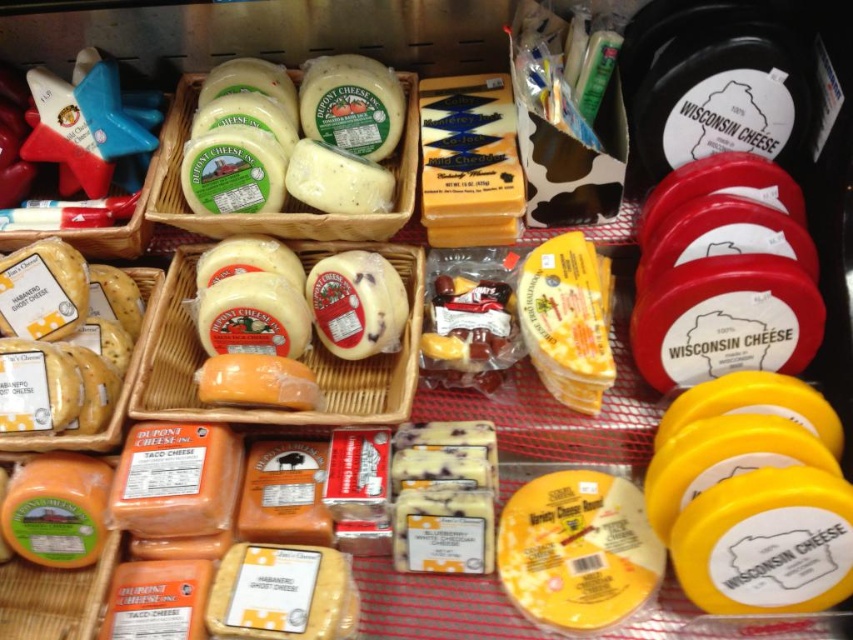
You are a customer standing in front of the cheese display. You want to pick up the yellow matte variety cheese round at center and the white paperboard cheese at center. Which one do you need to reach further back to grab?

The white paperboard cheese at center is further away from you, so you need to reach further back to grab it.

Based on the photo, you are a store employee who needs to restock the refrigerated section. You have two yellow cheeses to place on the shelf. The yellow matte variety cheese round at center and the yellow cheese at left. Which cheese takes up more space on the shelf?

The yellow cheese at left takes up more space on the shelf than the yellow matte variety cheese round at center because the yellow matte variety cheese round at center occupies less space than yellow cheese at left according to the description.

You are a customer looking at the cheese display. You want to grab the yellow cheese at left first, then the yellow matte variety cheese round at center. Which one will you reach first?

The yellow cheese at left is behind the yellow matte variety cheese round at center, so you will reach the yellow matte variety cheese round at center first before accessing the yellow cheese at left.